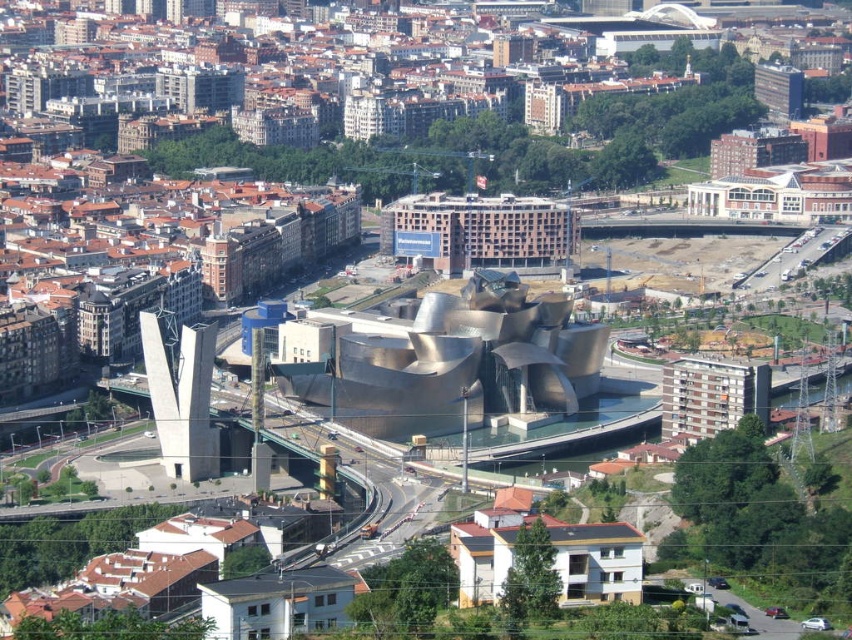
Question: Can you confirm if metallic silver building at center is positioned below white concrete building at center right?

Choices:
 (A) yes
 (B) no

Answer: (B)

Question: Does metallic silver building at center have a larger size compared to white concrete building at center right?

Choices:
 (A) no
 (B) yes

Answer: (B)

Question: Which is farther from the white painted concrete building at lower center?

Choices:
 (A) white concrete building at center right
 (B) metallic silver building at center

Answer: (B)

Question: Based on their relative distances, which object is nearer to the white concrete building at center right?

Choices:
 (A) white painted concrete building at lower center
 (B) metallic silver building at center
 (C) brown brick building at center

Answer: (B)

Question: Is brown brick building at center wider than white painted concrete building at lower center?

Choices:
 (A) no
 (B) yes

Answer: (B)

Question: Which point appears farthest from the camera in this image?

Choices:
 (A) (450, 326)
 (B) (484, 593)
 (C) (689, 365)
 (D) (444, 253)

Answer: (D)